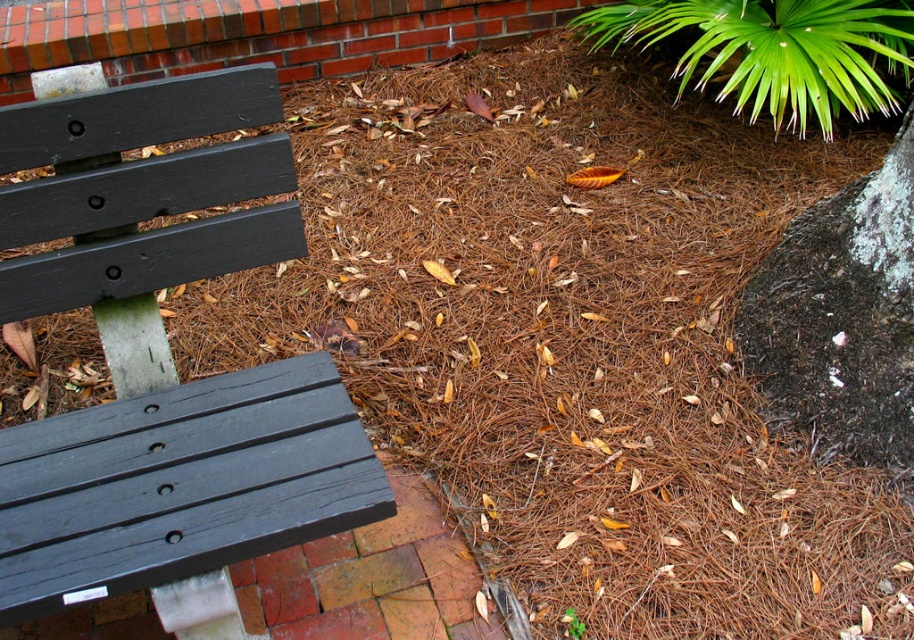
You are standing in the garden and want to place a small potted plant between the matte black bench at left and the green leafy plant at upper right. Based on their positions, where should you position the potted plant?

The matte black bench at left is located below the green leafy plant at upper right, so you should place the potted plant between them in the middle area between the bench and the plant.

Based on the photo, you are designing a garden layout and need to place a new 1.2 meter wide decorative stone between the matte black bench at left and the green leafy plant at upper right. Based on their widths, will the stone fit between them without overlapping either?

The matte black bench at left is narrower than the green leafy plant at upper right. Since the stone is 1.2 meters wide, but the exact widths of the objects aren

You are a gardener who needs to water the green leafy plant at upper right. You are currently standing next to the matte black bench at left. Can you reach the plant with a 1.5 meter long hose without moving the hose nozzle?

The distance between the matte black bench at left and the green leafy plant at upper right is 1.39 meters. Since the hose is 1.5 meters long, which is longer than the distance between them, you can reach the plant with the hose without needing to move the nozzle.